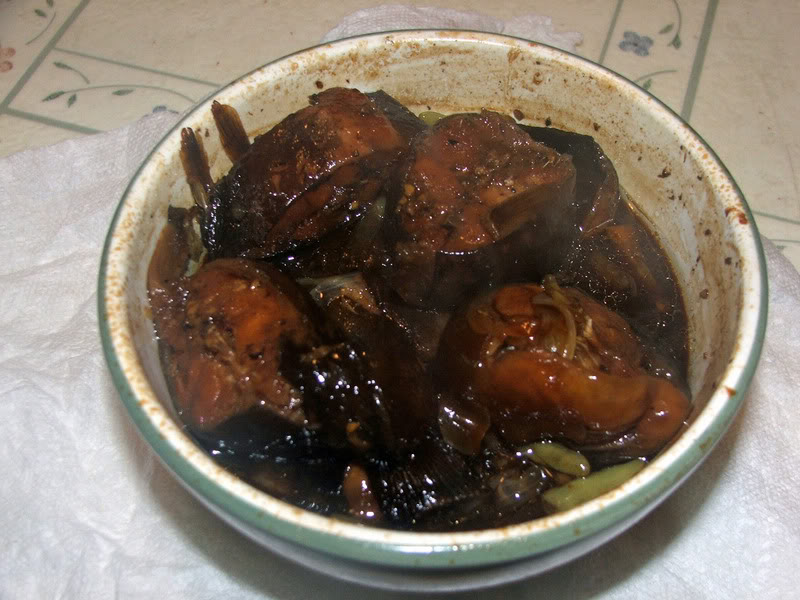
At what (x,y) coordinates should I click in order to perform the action: click on bowl. Please return your answer as a coordinate pair (x, y). This screenshot has height=600, width=800. Looking at the image, I should click on (596, 521).